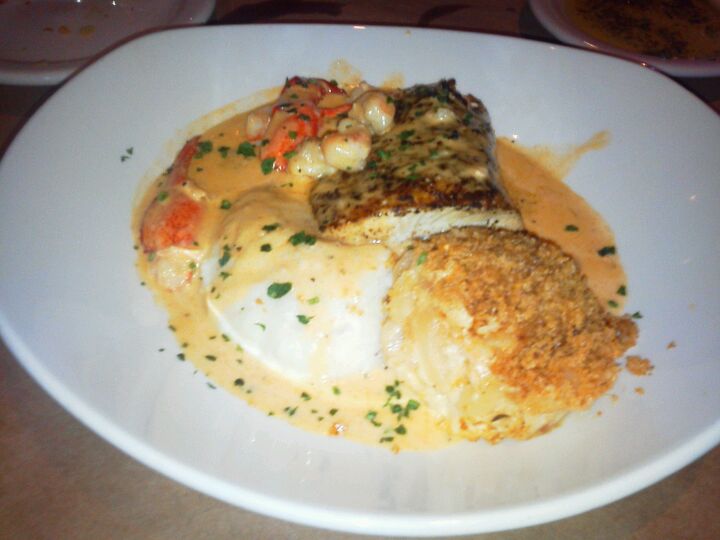
Locate an element on the screen. white plate is located at coordinates (201, 62), (626, 455).